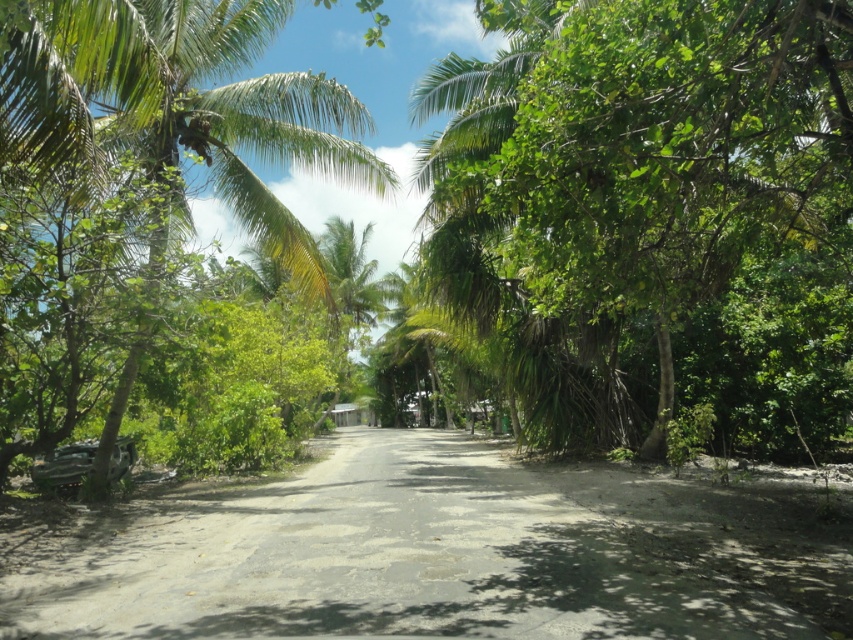
Question: Is the position of green leafy palm tree at center more distant than that of dirt road at center?

Choices:
 (A) no
 (B) yes

Answer: (B)

Question: Among these objects, which one is nearest to the camera?

Choices:
 (A) green leafy palm tree at center
 (B) green leafy palm tree at left
 (C) dirt road at center

Answer: (C)

Question: Is dirt road at center wider than green leafy palm tree at left?

Choices:
 (A) no
 (B) yes

Answer: (B)

Question: Is green leafy palm tree at center thinner than dirt road at center?

Choices:
 (A) no
 (B) yes

Answer: (B)

Question: Based on their relative distances, which object is farther from the green leafy palm tree at center?

Choices:
 (A) dirt road at center
 (B) green leafy palm tree at left

Answer: (B)

Question: Which point is farther from the camera taking this photo?

Choices:
 (A) (119, 390)
 (B) (625, 385)
 (C) (469, 545)

Answer: (B)